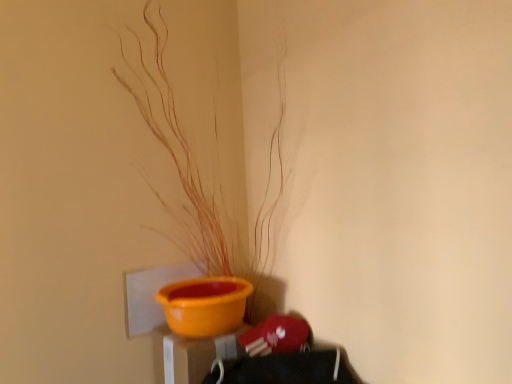
Question: Is orange matte plant at center oriented away from orange matte bowl at lower center?

Choices:
 (A) no
 (B) yes

Answer: (A)

Question: From a real-world perspective, is orange matte plant at center physically below orange matte bowl at lower center?

Choices:
 (A) yes
 (B) no

Answer: (B)

Question: Is orange matte plant at center further to camera compared to orange matte bowl at lower center?

Choices:
 (A) no
 (B) yes

Answer: (A)

Question: Does orange matte plant at center have a lesser width compared to orange matte bowl at lower center?

Choices:
 (A) yes
 (B) no

Answer: (B)

Question: Would you say orange matte bowl at lower center is part of orange matte plant at center's contents?

Choices:
 (A) no
 (B) yes

Answer: (A)

Question: From a real-world perspective, is orange matte plant at center located higher than orange matte bowl at lower center?

Choices:
 (A) yes
 (B) no

Answer: (A)

Question: Is orange matte bowl at lower center beside orange matte plant at center?

Choices:
 (A) yes
 (B) no

Answer: (B)

Question: Is orange matte bowl at lower center taller than orange matte plant at center?

Choices:
 (A) no
 (B) yes

Answer: (A)

Question: From a real-world perspective, is orange matte bowl at lower center beneath orange matte plant at center?

Choices:
 (A) yes
 (B) no

Answer: (A)

Question: Is orange matte bowl at lower center facing towards orange matte plant at center?

Choices:
 (A) no
 (B) yes

Answer: (A)

Question: Is orange matte bowl at lower center located outside orange matte plant at center?

Choices:
 (A) no
 (B) yes

Answer: (B)

Question: Can you confirm if orange matte bowl at lower center is bigger than orange matte plant at center?

Choices:
 (A) yes
 (B) no

Answer: (B)

Question: Is orange matte bowl at lower center taller or shorter than orange matte plant at center?

Choices:
 (A) short
 (B) tall

Answer: (A)